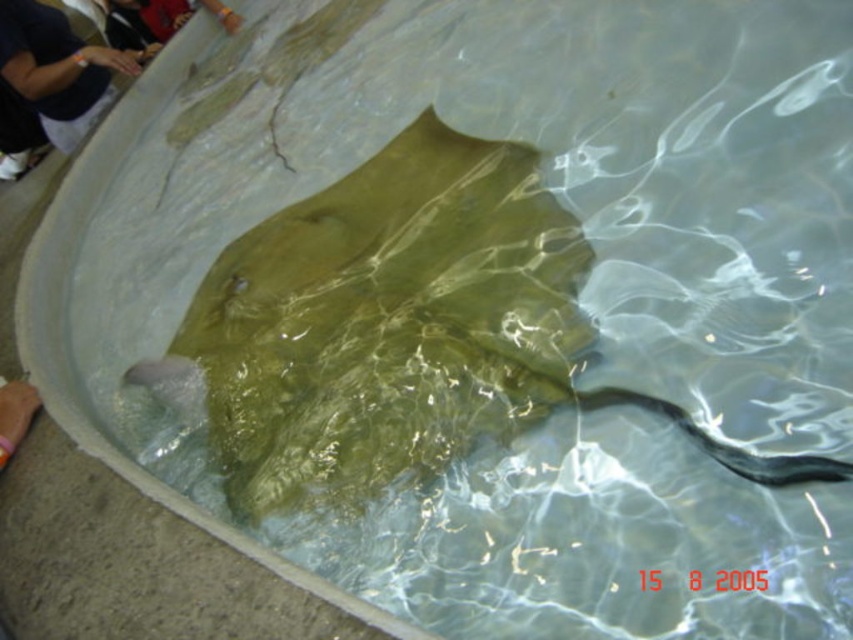
Does greenish-brown glossy stingray at center have a lesser height compared to dark blue shirt at upper left?

No.

Does greenish-brown glossy stingray at center come behind dark blue shirt at upper left?

That is False.

Is point (450, 355) closer to camera compared to point (44, 106)?

Yes.

The width and height of the screenshot is (853, 640). I want to click on greenish-brown glossy stingray at center, so click(x=387, y=323).